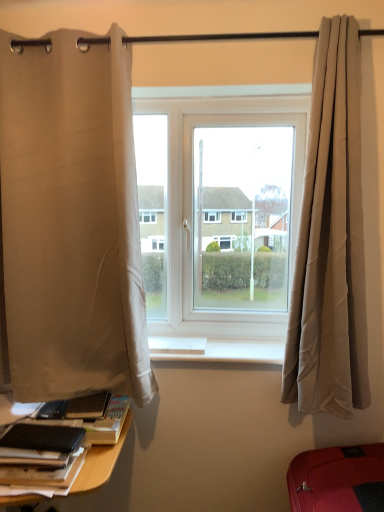
Question: Would you say white plastic window at center is to the left or to the right of white fabric curtain at left, the first curtain viewed from the left, in the picture?

Choices:
 (A) right
 (B) left

Answer: (A)

Question: Would you say white plastic window at center is inside or outside white fabric curtain at left, the first curtain viewed from the left?

Choices:
 (A) outside
 (B) inside

Answer: (A)

Question: Estimate the real-world distances between objects in this image. Which object is closer to the white fabric curtain at left, the first curtain viewed from the left?

Choices:
 (A) rubberized red suitcase at lower right
 (B) white smooth window sill at center
 (C) beige fabric curtain at right, the first curtain from the right
 (D) black matte book at lower left
 (E) white plastic window at center

Answer: (E)

Question: Which is nearer to the beige fabric curtain at right, the 2th curtain when ordered from left to right?

Choices:
 (A) white fabric curtain at left, the second curtain from the right
 (B) white smooth window sill at center
 (C) black matte book at lower left
 (D) white plastic window at center
 (E) rubberized red suitcase at lower right

Answer: (D)